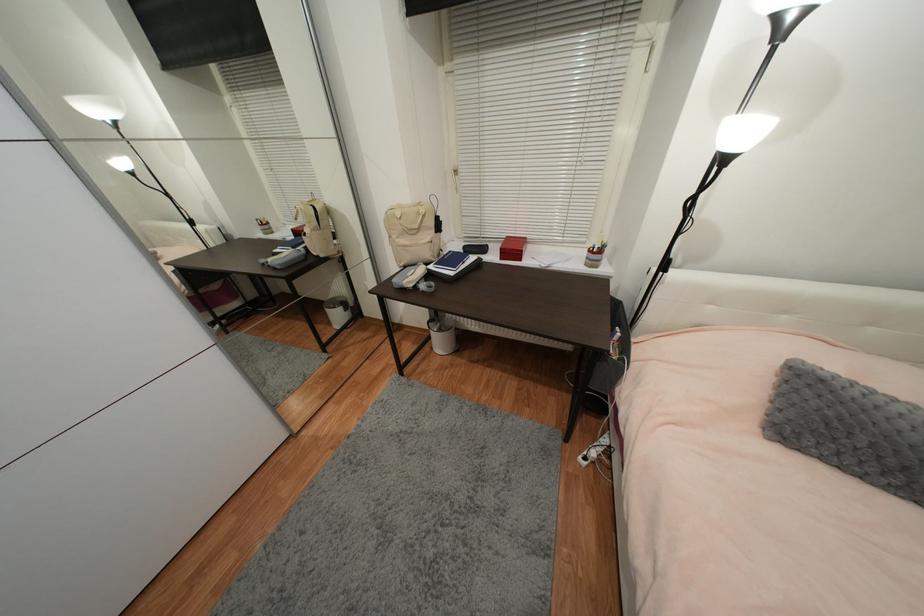
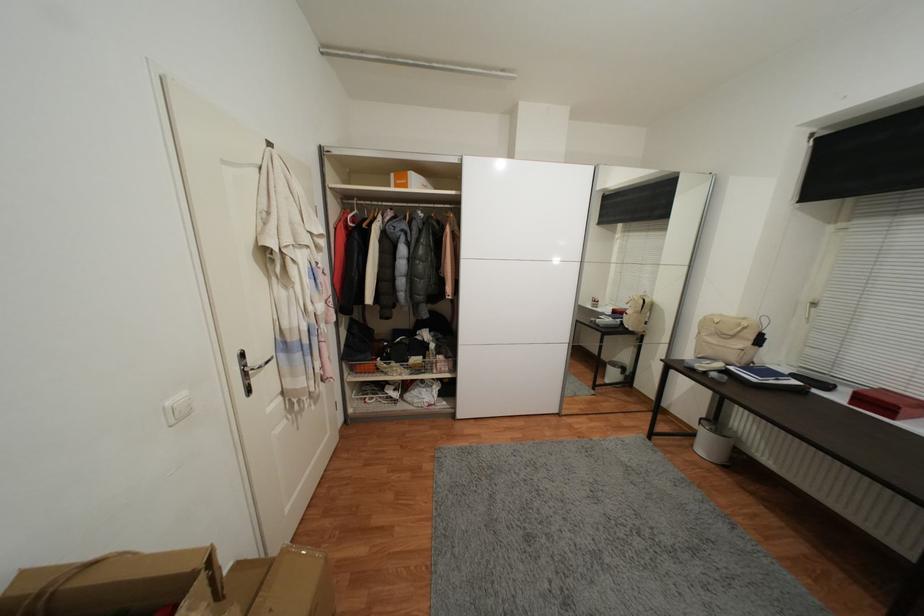
Where in the second image is the point corresponding to (525,262) from the first image?

(897, 419)